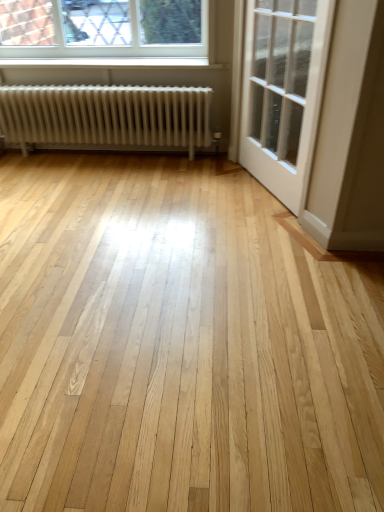
Question: Is white matte radiator at left in front of or behind white glossy door at upper right in the image?

Choices:
 (A) front
 (B) behind

Answer: (B)

Question: Looking at their shapes, would you say white matte radiator at left is wider or thinner than white glossy door at upper right?

Choices:
 (A) thin
 (B) wide

Answer: (B)

Question: Which is nearer to the white glossy door at upper right?

Choices:
 (A) clear glass window at upper left
 (B) white matte radiator at left

Answer: (B)

Question: Estimate the real-world distances between objects in this image. Which object is closer to the white glossy door at upper right?

Choices:
 (A) white matte radiator at left
 (B) clear glass window at upper left

Answer: (A)